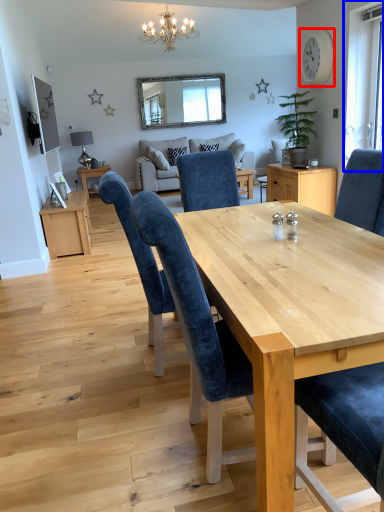
Question: Which of the following is the closest to the observer, clock (highlighted by a red box) or window (highlighted by a blue box)?

Choices:
 (A) clock
 (B) window

Answer: (B)